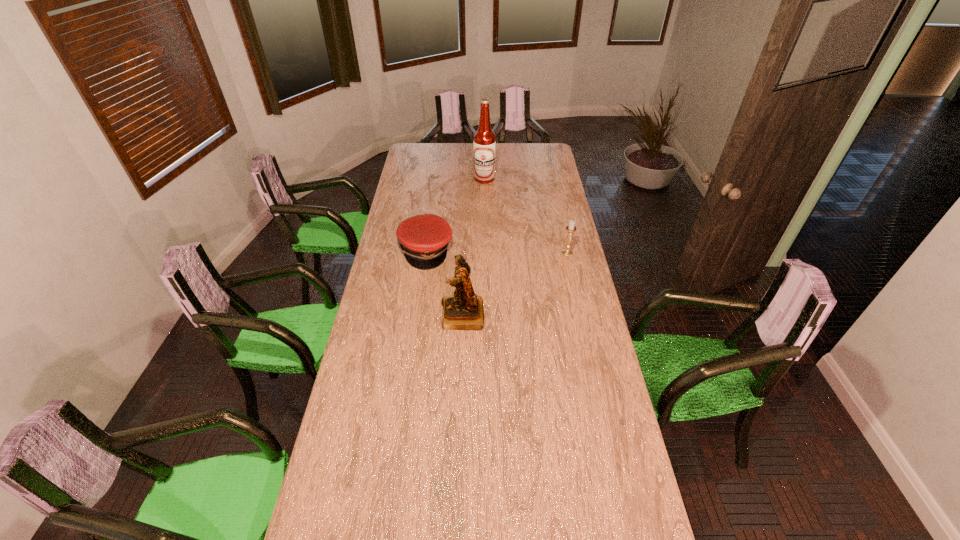
At what (x,y) coordinates should I click in order to perform the action: click on the third shortest object. Please return your answer as a coordinate pair (x, y). The width and height of the screenshot is (960, 540). Looking at the image, I should click on (464, 311).

Where is `the nearest object`? the nearest object is located at coordinates (464, 311).

The height and width of the screenshot is (540, 960). I want to click on candle holder, so click(571, 228).

Locate an element on the screen. the rightmost object is located at coordinates (571, 228).

Identify the location of cap. (424, 238).

Locate an element on the screen. the farthest object is located at coordinates (484, 141).

The image size is (960, 540). I want to click on alcohol, so click(484, 141).

Identify the location of vacant space located 0.160m on the front-facing side of the nearest object. (400, 315).

Identify the location of vacant space located 0.190m on the front-facing side of the nearest object. (x=394, y=315).

The width and height of the screenshot is (960, 540). Identify the location of vacant area located 0.130m on the front-facing side of the nearest object. (408, 315).